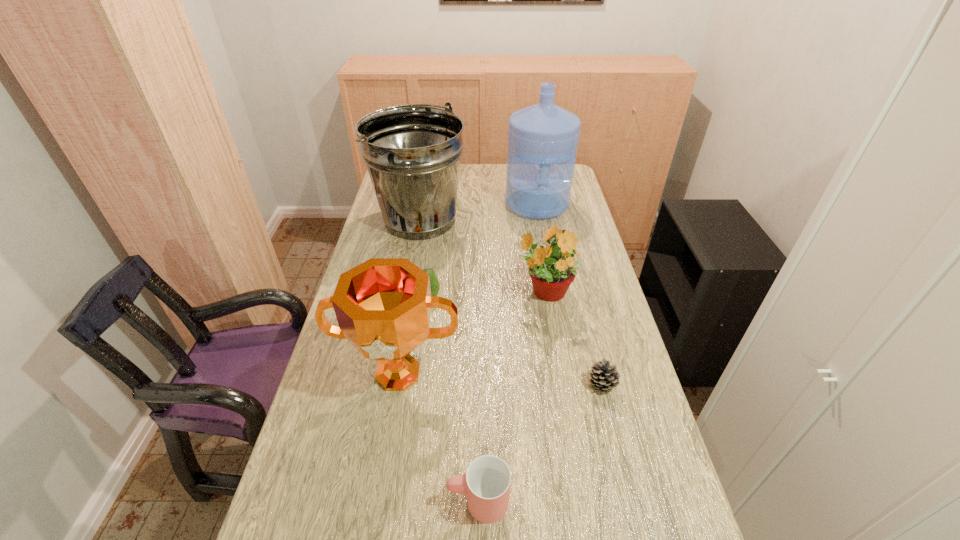
I want to click on vacant space that is in between the cup and the award, so click(438, 438).

Find the location of a particular element. Image resolution: width=960 pixels, height=540 pixels. vacant space in between the bucket and the water jug is located at coordinates (478, 212).

Identify which object is the nearest to the second tallest object. Please provide its 2D coordinates. Your answer should be formatted as a tuple, i.e. [(x, y)], where the tuple contains the x and y coordinates of a point satisfying the conditions above.

[(543, 138)]

At what (x,y) coordinates should I click in order to perform the action: click on object that is the third nearest to the nearest object. Please return your answer as a coordinate pair (x, y). Image resolution: width=960 pixels, height=540 pixels. Looking at the image, I should click on (552, 267).

At what (x,y) coordinates should I click in order to perform the action: click on vacant area in the image that satisfies the following two spatial constraints: 1. on the back side of the avocado; 2. on the right side of the flowerpot. Please return your answer as a coordinate pair (x, y). Looking at the image, I should click on (429, 293).